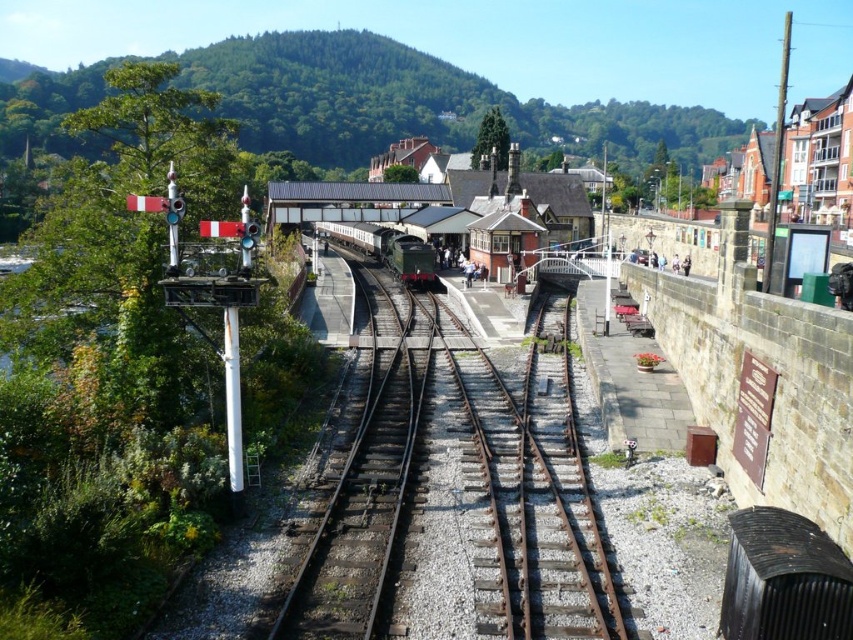
Which is behind, point (337, 550) or point (412, 256)?

Positioned behind is point (412, 256).

Who is positioned more to the left, rusty metal tracks at center or green polished wood train at center?

From the viewer's perspective, green polished wood train at center appears more on the left side.

At what (x,y) coordinates should I click in order to perform the action: click on rusty metal tracks at center. Please return your answer as a coordinate pair (x, y). The width and height of the screenshot is (853, 640). Looking at the image, I should click on (457, 490).

This screenshot has height=640, width=853. I want to click on rusty metal tracks at center, so click(457, 490).